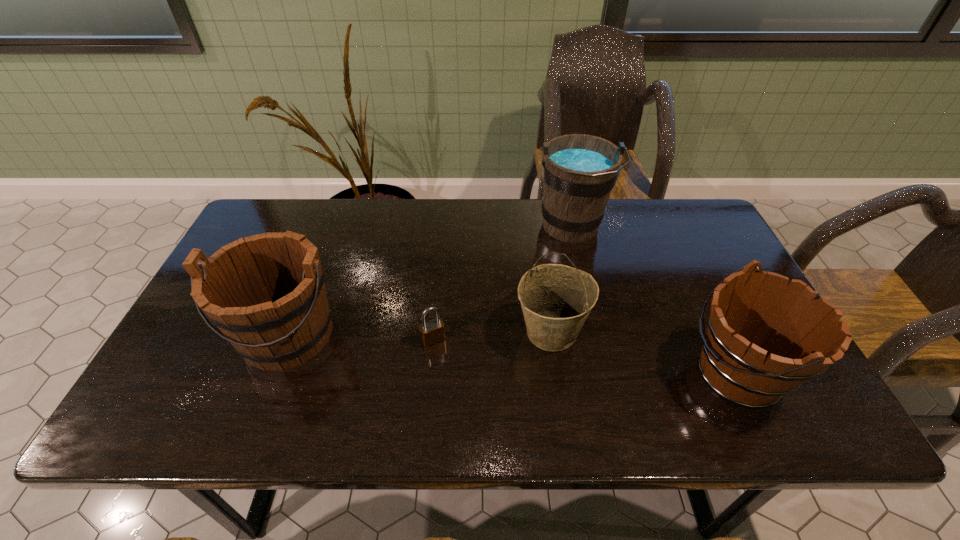
Where is `the farthest wine bucket`? This screenshot has height=540, width=960. the farthest wine bucket is located at coordinates [x=579, y=171].

This screenshot has width=960, height=540. What are the coordinates of `the leftmost wine bucket` in the screenshot? It's located at (266, 293).

Find the location of a particular element. Image resolution: width=960 pixels, height=540 pixels. the rightmost wine bucket is located at coordinates 765,336.

Identify the location of padlock. The width and height of the screenshot is (960, 540). pos(432,331).

At what (x,y) coordinates should I click in order to perform the action: click on the shortest object. Please return your answer as a coordinate pair (x, y). This screenshot has height=540, width=960. Looking at the image, I should click on (432, 331).

The image size is (960, 540). In order to click on free location located 0.220m with a handle on the side of the farthest object in this screenshot , I will do `click(590, 312)`.

This screenshot has height=540, width=960. Find the location of `vacant position located 0.050m on the side of the leftmost object with the handle for carrying`. vacant position located 0.050m on the side of the leftmost object with the handle for carrying is located at coordinates (263, 399).

Where is `free space located 0.270m with the handle on the rightmost object`? This screenshot has height=540, width=960. free space located 0.270m with the handle on the rightmost object is located at coordinates (566, 372).

Find the location of `vacant space situated with the handle on the rightmost object`. vacant space situated with the handle on the rightmost object is located at coordinates (592, 372).

Locate an element on the screen. This screenshot has width=960, height=540. vacant area situated with the handle on the rightmost object is located at coordinates (596, 372).